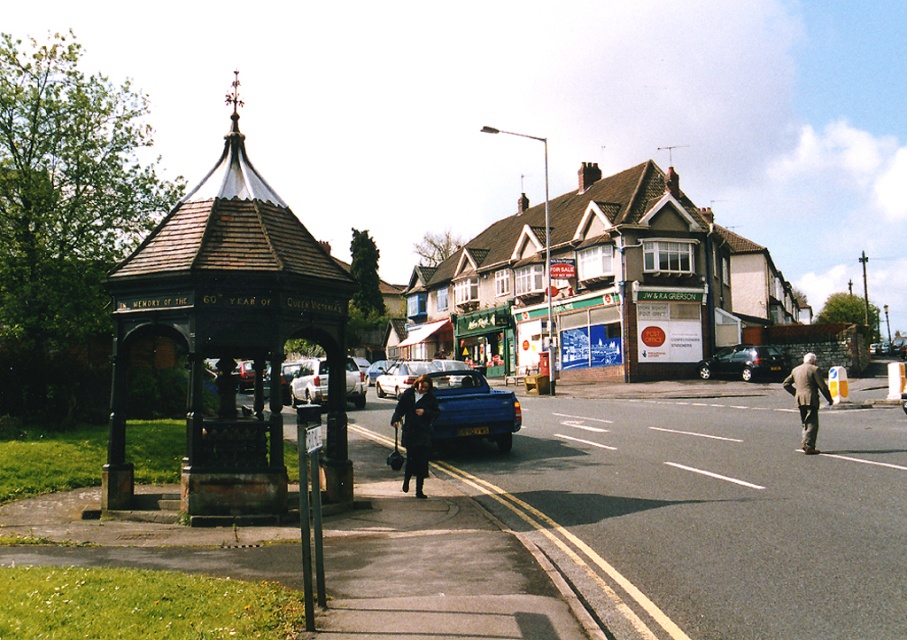
Which is in front, point (784, 365) or point (418, 365)?

Positioned in front is point (418, 365).

At what (x,y) coordinates should I click in order to perform the action: click on shiny black car at center. Please return your answer as a coordinate pair (x, y). This screenshot has width=907, height=640. Looking at the image, I should click on click(x=745, y=362).

Is silver metallic car at center in front of metallic blue pickup truck at center?

Yes.

Locate an element on the screen. The height and width of the screenshot is (640, 907). silver metallic car at center is located at coordinates (309, 381).

Does wooden gazebo at left appear on the left side of dark blue coat at center?

Yes, wooden gazebo at left is to the left of dark blue coat at center.

Between point (239, 426) and point (428, 401), which one is positioned behind?

The point (428, 401) is behind.

Is point (201, 346) positioned in front of point (427, 403)?

Yes, point (201, 346) is in front of point (427, 403).

Image resolution: width=907 pixels, height=640 pixels. I want to click on wooden gazebo at left, so click(231, 333).